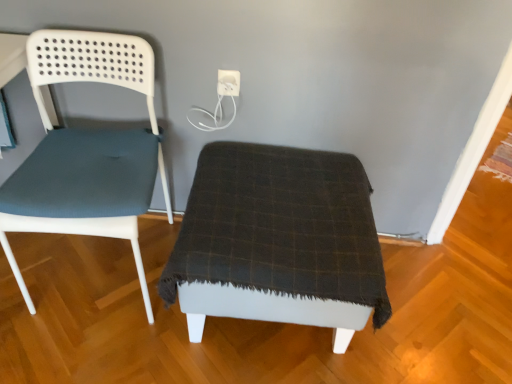
At what (x,y) coordinates should I click in order to perform the action: click on free space above dark plaid fabric ottoman at center (from a real-world perspective). Please return your answer as a coordinate pair (x, y). Looking at the image, I should click on (232, 197).